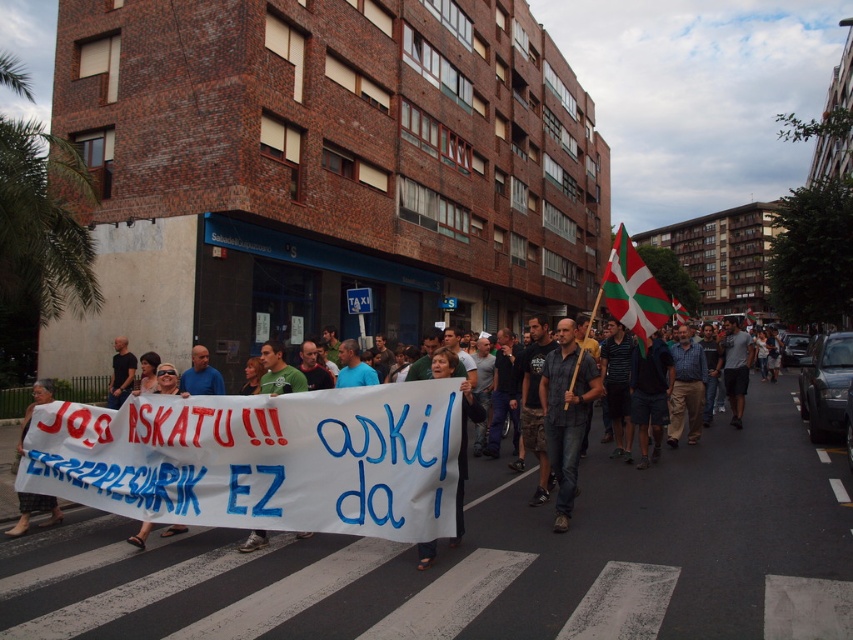
You are a photographer trying to capture a clear shot of both the red and white striped flag at center and the white fabric flag at center. Which flag should you focus on first to ensure it fits within your camera frame?

The red and white striped flag at center might be wider than the white fabric flag at center, so focusing on the wider one first would help ensure both fit in the frame.

You are a photographer at the protest. You want to capture a photo where both the denim jeans at center and the white fabric flag at center are clearly visible. Which object should you focus on first to ensure the smaller one is in sharp focus?

You should focus on the denim jeans at center first because it is smaller than the white fabric flag at center, so ensuring its sharpness will help both objects be in focus.